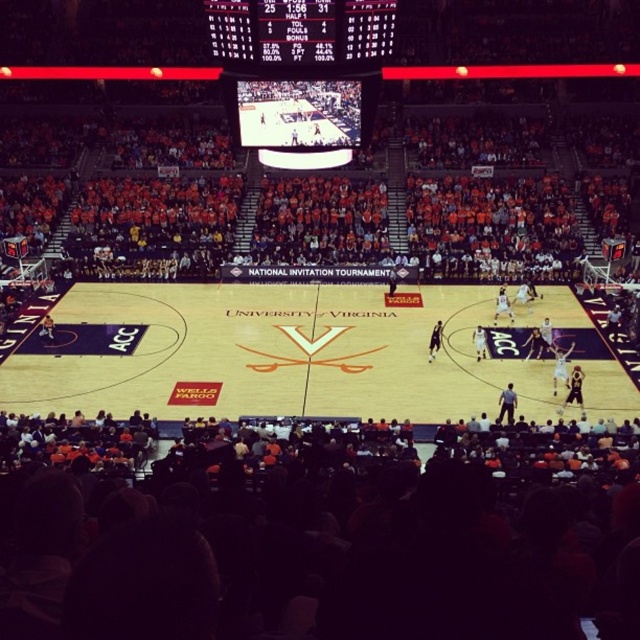
Is black glossy scoreboard at upper center shorter than black plastic scoreboard at upper center?

No.

Is point (227, 64) more distant than point (296, 26)?

Yes.

You are a GUI agent. You are given a task and a screenshot of the screen. Output one action in this format:
    pyautogui.click(x=<x>, y=<y>)
    Task: Click on the black glossy scoreboard at upper center
    
    Given the screenshot: What is the action you would take?
    pyautogui.click(x=301, y=74)

Who is positioned more to the left, wooden basketball court at center or black glossy scoreboard at upper center?

black glossy scoreboard at upper center

Can you confirm if wooden basketball court at center is smaller than black glossy scoreboard at upper center?

No.

Is point (541, 404) farther from viewer compared to point (230, 67)?

Yes, it is.

Where is `wooden basketball court at center`? This screenshot has height=640, width=640. wooden basketball court at center is located at coordinates (280, 355).

Is point (216, 534) positioned in front of point (218, 16)?

Yes, it is.

Describe the element at coordinates (346, 554) in the screenshot. The width and height of the screenshot is (640, 640). I see `orange fabric seats at lower center` at that location.

Measure the distance between point (561, 545) and camera.

A distance of 45.50 feet exists between point (561, 545) and camera.

Where is `orange fabric seats at lower center`? The image size is (640, 640). orange fabric seats at lower center is located at coordinates (346, 554).